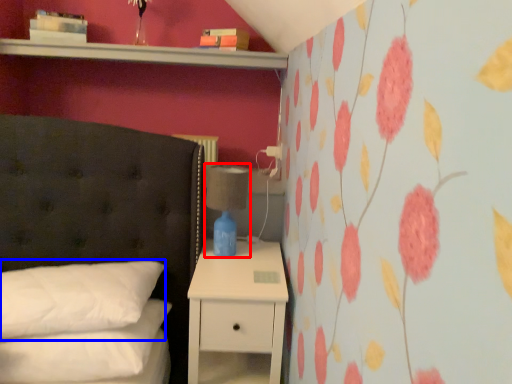
Question: Among these objects, which one is nearest to the camera, bedside lamp (highlighted by a red box) or pillow (highlighted by a blue box)?

Choices:
 (A) bedside lamp
 (B) pillow

Answer: (B)